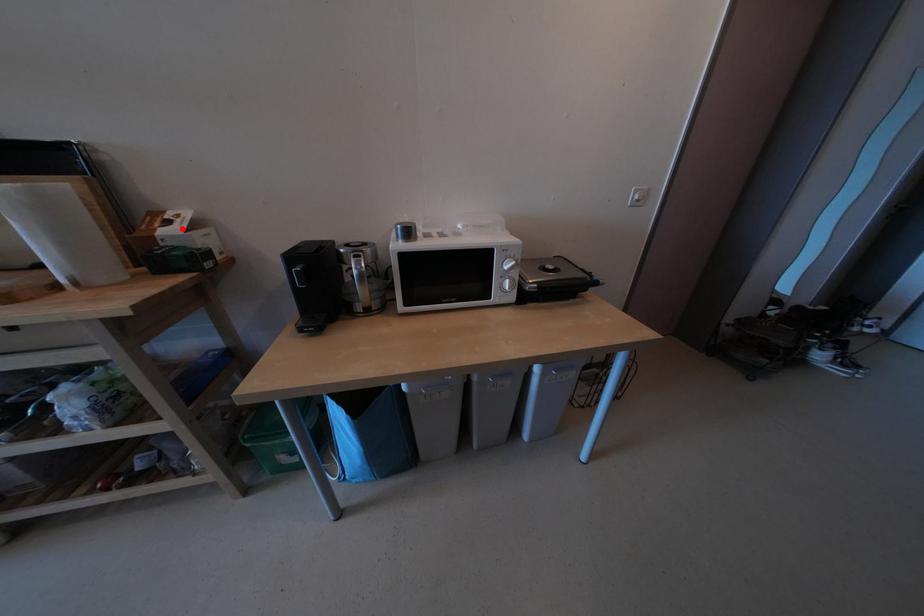
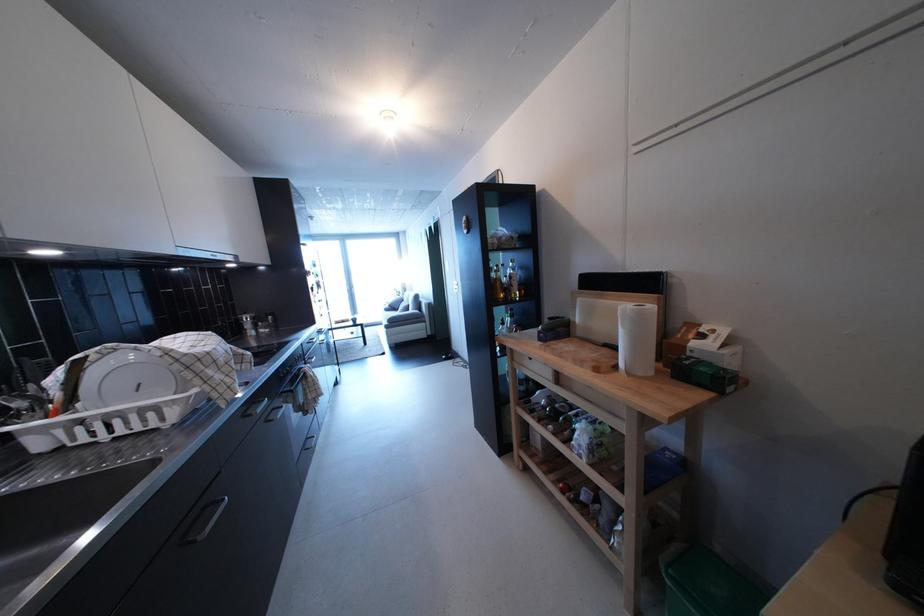
Where in the second image is the point corresponding to the highlighted location from the first image?

(715, 342)